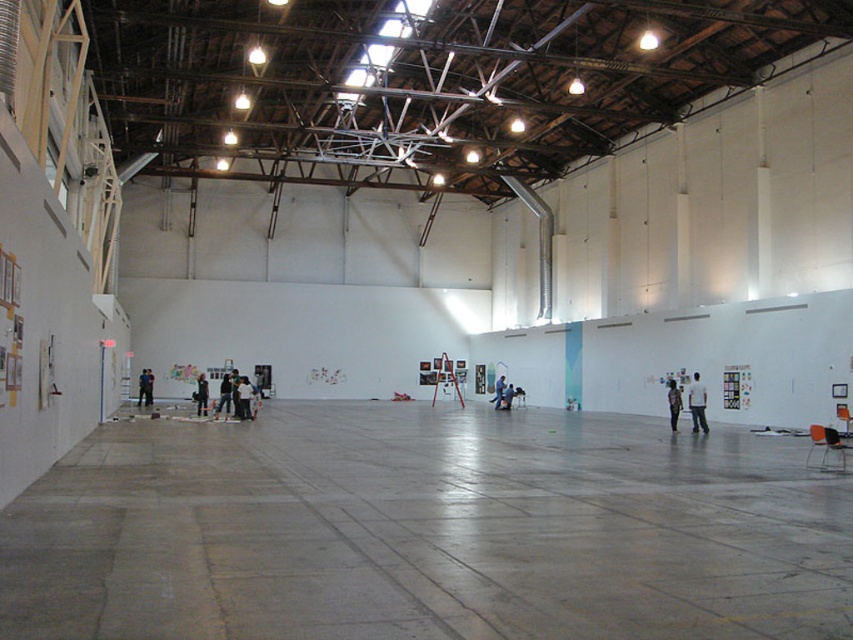
Question: Is black leather jacket at center to the right of black matte person at center from the viewer's perspective?

Choices:
 (A) no
 (B) yes

Answer: (B)

Question: Which point appears farthest from the camera in this image?

Choices:
 (A) (202, 381)
 (B) (503, 392)
 (C) (225, 396)
 (D) (502, 392)

Answer: (D)

Question: Does dark gray fabric jacket at center have a smaller size compared to dark gray jacket at center?

Choices:
 (A) no
 (B) yes

Answer: (B)

Question: Is black matte person at center to the right of blue jeans at center from the viewer's perspective?

Choices:
 (A) yes
 (B) no

Answer: (B)

Question: Which of the following is the closest to the observer?

Choices:
 (A) black matte person at center
 (B) white matte person at center
 (C) dark gray fabric jacket at center

Answer: (B)

Question: Which of the following is the closest to the observer?

Choices:
 (A) blue jeans at center
 (B) black matte person at center
 (C) white matte person at center
 (D) dark gray shirt at center

Answer: (C)